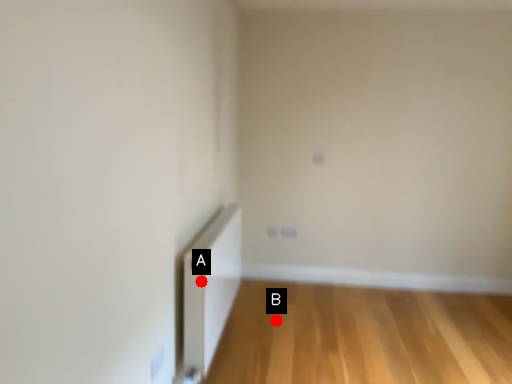
Question: Two points are circled on the image, labeled by A and B beside each circle. Which point appears farthest from the camera in this image?

Choices:
 (A) A is further
 (B) B is further

Answer: (B)